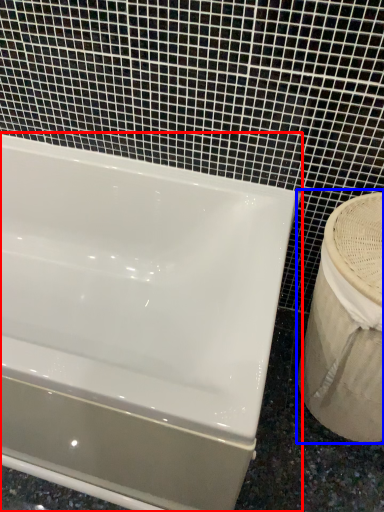
Question: Which of the following is the farthest to the observer, bathtub (highlighted by a red box) or sink (highlighted by a blue box)?

Choices:
 (A) bathtub
 (B) sink

Answer: (B)